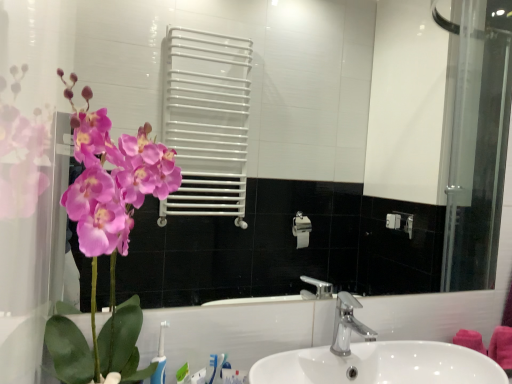
Question: In terms of width, does matte pink orchid at left look wider or thinner when compared to white glossy mirror at upper center?

Choices:
 (A) wide
 (B) thin

Answer: (A)

Question: Considering the positions of point (109, 365) and point (475, 254), is point (109, 365) closer or farther from the camera than point (475, 254)?

Choices:
 (A) farther
 (B) closer

Answer: (B)

Question: Which object is positioned farthest from the matte pink orchid at left?

Choices:
 (A) silver metallic faucet at center
 (B) white glossy mirror at upper center
 (C) white glossy sink at center
 (D) blue plastic toothbrush at lower left

Answer: (B)

Question: Which object is the closest to the blue plastic toothbrush at lower left?

Choices:
 (A) white glossy mirror at upper center
 (B) silver metallic faucet at center
 (C) matte pink orchid at left
 (D) white glossy sink at center

Answer: (C)